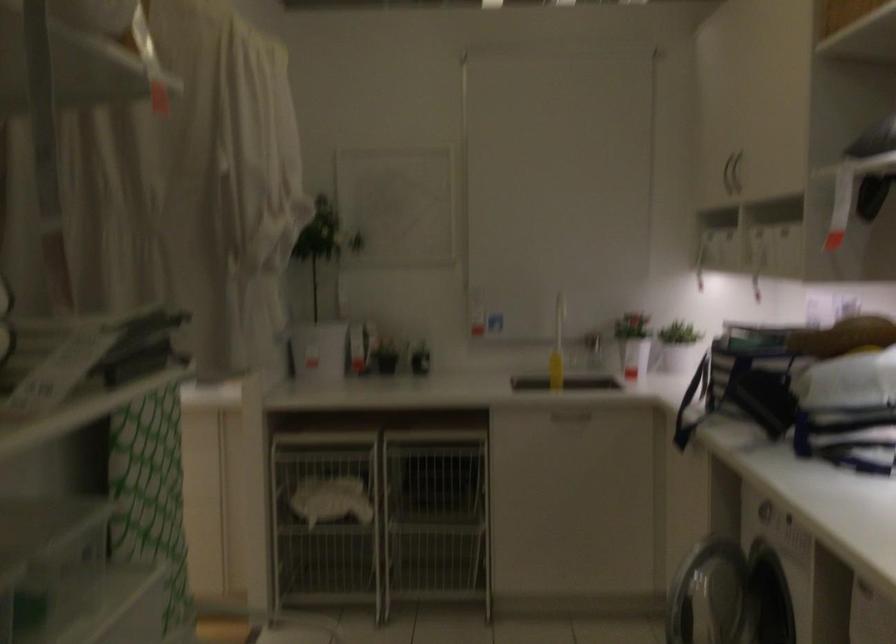
I want to click on washing machine door, so click(708, 594).